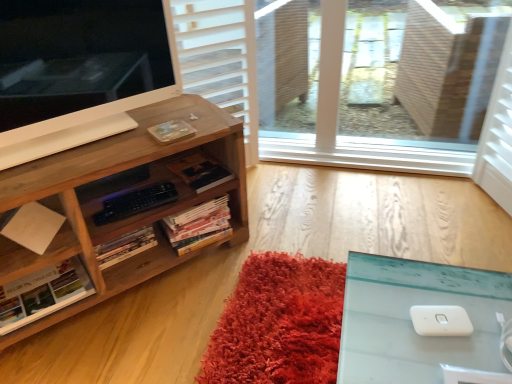
Identify the location of wooden bookcase at left. The width and height of the screenshot is (512, 384). (115, 192).

This screenshot has width=512, height=384. Describe the element at coordinates (44, 294) in the screenshot. I see `white paper at left, the fourth book positioned from the right` at that location.

Find the location of `hardcover book at center, the 3th book viewed from the right`. hardcover book at center, the 3th book viewed from the right is located at coordinates (125, 247).

Locate an element on the screen. The width and height of the screenshot is (512, 384). hardcover book at center, the first book from the right is located at coordinates (x=200, y=172).

Describe the element at coordinates (37, 254) in the screenshot. I see `white matte paper at lower left` at that location.

This screenshot has width=512, height=384. I want to click on wooden bookcase at left, so click(x=115, y=192).

Is there a large distance between hardcover books at center, which is the 3th book from left to right, and wooden bookcase at left?

hardcover books at center, which is the 3th book from left to right, is near wooden bookcase at left, not far away.

Is hardcover books at center, the second book from the right, wider or thinner than wooden bookcase at left?

In the image, hardcover books at center, the second book from the right, appears to be more narrow than wooden bookcase at left.

Is hardcover books at center, which is the 3th book from left to right, shorter than wooden bookcase at left?

Yes, hardcover books at center, which is the 3th book from left to right, is shorter than wooden bookcase at left.

Does hardcover books at center, the second book from the right, have a greater height compared to white paper at left, the first book positioned from the left?

Yes, hardcover books at center, the second book from the right, is taller than white paper at left, the first book positioned from the left.

Is hardcover books at center, which is the 3th book from left to right, positioned far away from white paper at left, the first book positioned from the left?

hardcover books at center, which is the 3th book from left to right, is near white paper at left, the first book positioned from the left, not far away.

Considering the sizes of objects hardcover books at center, which is the 3th book from left to right, and white paper at left, the first book positioned from the left, in the image provided, who is bigger, hardcover books at center, which is the 3th book from left to right, or white paper at left, the first book positioned from the left,?

hardcover books at center, which is the 3th book from left to right, is bigger.

From a real-world perspective, is hardcover books at center, the second book from the right, above or below white paper at left, the fourth book positioned from the right?

hardcover books at center, the second book from the right, is above white paper at left, the fourth book positioned from the right.

Is hardcover book at center, the 3th book viewed from the right, aimed at white glossy computer monitor at upper left?

No.

From a real-world perspective, is hardcover book at center, positioned as the 2th book in left-to-right order, beneath white glossy computer monitor at upper left?

Yes, from a real-world perspective, hardcover book at center, positioned as the 2th book in left-to-right order, is under white glossy computer monitor at upper left.

Is hardcover book at center, positioned as the 2th book in left-to-right order, not close to white glossy computer monitor at upper left?

hardcover book at center, positioned as the 2th book in left-to-right order, is near white glossy computer monitor at upper left, not far away.

From the image's perspective, is hardcover book at center, positioned as the 2th book in left-to-right order, located above or below white glossy computer monitor at upper left?

hardcover book at center, positioned as the 2th book in left-to-right order, is situated lower than white glossy computer monitor at upper left in the image.

From a real-world perspective, between hardcover book at center, positioned as the 2th book in left-to-right order, and white matte paper at lower left, who is vertically lower?

From a 3D spatial view, hardcover book at center, positioned as the 2th book in left-to-right order, is below.

Is hardcover book at center, positioned as the 2th book in left-to-right order, with white matte paper at lower left?

No, hardcover book at center, positioned as the 2th book in left-to-right order, is not touching white matte paper at lower left.

Considering the positions of points (129, 242) and (66, 240), is point (129, 242) closer to camera compared to point (66, 240)?

No, (129, 242) is further to viewer.

Is white matte paper at lower left in front of or behind white glossy computer monitor at upper left in the image?

Visually, white matte paper at lower left is located behind white glossy computer monitor at upper left.

Is white matte paper at lower left oriented towards white glossy computer monitor at upper left?

No.

In the image, is white matte paper at lower left on the left side or the right side of white glossy computer monitor at upper left?

In the image, white matte paper at lower left appears on the left side of white glossy computer monitor at upper left.

Is white matte paper at lower left not near white glossy computer monitor at upper left?

white matte paper at lower left is actually quite close to white glossy computer monitor at upper left.

From the image's perspective, who appears lower, hardcover book at center, the fourth book positioned from the left, or hardcover books at center, which is the 3th book from left to right?

hardcover books at center, which is the 3th book from left to right.

Which is in front, point (204, 158) or point (191, 210)?

The point (191, 210) is closer to the camera.

Considering the positions of objects hardcover book at center, the fourth book positioned from the left, and hardcover books at center, the second book from the right, in the image provided, who is behind, hardcover book at center, the fourth book positioned from the left, or hardcover books at center, the second book from the right,?

hardcover book at center, the fourth book positioned from the left, is further away from the camera.

Is hardcover book at center, the first book from the right, touching hardcover books at center, which is the 3th book from left to right?

hardcover book at center, the first book from the right, is not next to hardcover books at center, which is the 3th book from left to right, and they're not touching.

Does wooden bookcase at left have a greater height compared to white glossy computer monitor at upper left?

Yes, wooden bookcase at left is taller than white glossy computer monitor at upper left.

The width and height of the screenshot is (512, 384). In order to click on computer monitor above the wooden bookcase at left (from the image's perspective) in this screenshot , I will do (79, 71).

Is wooden bookcase at left behind white glossy computer monitor at upper left?

Yes, wooden bookcase at left is behind white glossy computer monitor at upper left.

From a real-world perspective, is wooden bookcase at left positioned above or below white glossy computer monitor at upper left?

From a real-world perspective, wooden bookcase at left is physically below white glossy computer monitor at upper left.

The width and height of the screenshot is (512, 384). In order to click on bookcase in front of the hardcover books at center, the second book from the right in this screenshot , I will do `click(115, 192)`.

You are a GUI agent. You are given a task and a screenshot of the screen. Output one action in this format:
    pyautogui.click(x=<x>, y=<y>)
    Task: Click on the 2nd book to the left when counting from the hardcover books at center, the second book from the right
    
    Given the screenshot: What is the action you would take?
    pyautogui.click(x=44, y=294)

From the image, which object appears to be nearer to white glossy computer monitor at upper left, hardcover book at center, positioned as the 2th book in left-to-right order, or white matte paper at lower left?

The object closer to white glossy computer monitor at upper left is white matte paper at lower left.

Looking at the image, which one is located further to hardcover book at center, the fourth book positioned from the left, hardcover books at center, the second book from the right, or white glossy computer monitor at upper left?

white glossy computer monitor at upper left.

Consider the image. Considering their positions, is white matte paper at lower left positioned closer to hardcover books at center, which is the 3th book from left to right, than white paper at left, the first book positioned from the left?

white matte paper at lower left lies closer to hardcover books at center, which is the 3th book from left to right, than the other object.

Which object lies further to the anchor point hardcover book at center, the fourth book positioned from the left, white paper at left, the fourth book positioned from the right, or hardcover books at center, which is the 3th book from left to right?

white paper at left, the fourth book positioned from the right.

From the image, which object appears to be nearer to white matte paper at lower left, hardcover book at center, the first book from the right, or white glossy computer monitor at upper left?

white glossy computer monitor at upper left.

When comparing their distances from white matte paper at lower left, does hardcover book at center, positioned as the 2th book in left-to-right order, or white glossy computer monitor at upper left seem further?

white glossy computer monitor at upper left.

Considering their positions, is hardcover book at center, the fourth book positioned from the left, positioned closer to white paper at left, the first book positioned from the left, than wooden bookcase at left?

wooden bookcase at left is positioned closer to the anchor white paper at left, the first book positioned from the left.

From the image, which object appears to be farther from white paper at left, the fourth book positioned from the right, hardcover book at center, the first book from the right, or white matte paper at lower left?

The object further to white paper at left, the fourth book positioned from the right, is hardcover book at center, the first book from the right.

Find the location of a particular element. The image size is (512, 384). bookcase between white glossy computer monitor at upper left and white matte paper at lower left in the vertical direction is located at coordinates (115, 192).

Identify the location of book situated between hardcover book at center, positioned as the 2th book in left-to-right order, and hardcover book at center, the fourth book positioned from the left, from left to right. This screenshot has width=512, height=384. [x=199, y=225].

The height and width of the screenshot is (384, 512). In order to click on shelf between white paper at left, the fourth book positioned from the right, and hardcover book at center, the 3th book viewed from the right, from left to right in this screenshot , I will do `click(37, 254)`.

You are a GUI agent. You are given a task and a screenshot of the screen. Output one action in this format:
    pyautogui.click(x=<x>, y=<y>)
    Task: Click on the bookcase between white glossy computer monitor at upper left and hardcover book at center, positioned as the 2th book in left-to-right order, in the up-down direction
    
    Given the screenshot: What is the action you would take?
    pyautogui.click(x=115, y=192)